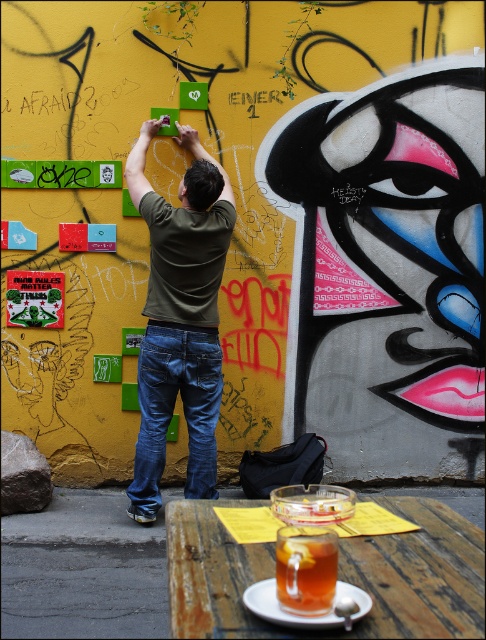
Question: Which object appears farthest from the camera in this image?

Choices:
 (A) translucent glass cup at lower center
 (B) green matte shirt at center

Answer: (B)

Question: Which object is the farthest from the denim at center?

Choices:
 (A) green matte shirt at center
 (B) translucent glass cup at lower center

Answer: (B)

Question: Does denim at center appear on the left side of translucent glass cup at lower center?

Choices:
 (A) yes
 (B) no

Answer: (A)

Question: In this image, where is green matte shirt at center located relative to denim at center?

Choices:
 (A) right
 (B) left

Answer: (B)

Question: Which of the following is the closest to the observer?

Choices:
 (A) translucent glass cup at lower center
 (B) green matte shirt at center

Answer: (A)

Question: Is green matte shirt at center positioned at the back of translucent glass cup at lower center?

Choices:
 (A) no
 (B) yes

Answer: (B)